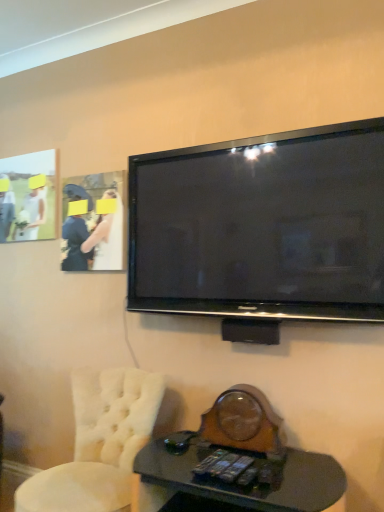
The width and height of the screenshot is (384, 512). Describe the element at coordinates (243, 475) in the screenshot. I see `black glass desk at lower center` at that location.

What do you see at coordinates (262, 227) in the screenshot? I see `black glossy flat-screen tv at upper center` at bounding box center [262, 227].

Where is `white tufted chair at lower left`? The image size is (384, 512). white tufted chair at lower left is located at coordinates [99, 443].

Locate an element on the screen. The image size is (384, 512). black glass desk at lower center is located at coordinates tap(243, 475).

What's the angular difference between black glossy flat-screen tv at upper center and white tufted chair at lower left's facing directions?

1.19 degrees separate the facing orientations of black glossy flat-screen tv at upper center and white tufted chair at lower left.

Image resolution: width=384 pixels, height=512 pixels. I want to click on chair in front of the black glossy flat-screen tv at upper center, so click(99, 443).

Considering the points (230, 306) and (19, 498), which point is in front, point (230, 306) or point (19, 498)?

Positioned in front is point (19, 498).

From a real-world perspective, between black glossy flat-screen tv at upper center and white tufted chair at lower left, who is vertically lower?

white tufted chair at lower left, from a real-world perspective.

Is black glass desk at lower center not inside matte white dress at upper left?

Yes, black glass desk at lower center is located beyond the bounds of matte white dress at upper left.

Is black glass desk at lower center far away from matte white dress at upper left?

Yes, black glass desk at lower center and matte white dress at upper left are located far from each other.

From the image's perspective, is black glass desk at lower center on matte white dress at upper left?

No, from the image's perspective, black glass desk at lower center is not above matte white dress at upper left.

How distant is black glass desk at lower center from white tufted chair at lower left?

14.72 inches.

From the image's perspective, which one is positioned higher, black glass desk at lower center or white tufted chair at lower left?

white tufted chair at lower left, from the image's perspective.

Can white tufted chair at lower left be found inside black glass desk at lower center?

No, white tufted chair at lower left is not a part of black glass desk at lower center.

Considering the relative positions of black glass desk at lower center and white tufted chair at lower left in the image provided, is black glass desk at lower center behind white tufted chair at lower left?

No.

Based on their positions, is matte white picture frame at upper left located to the left or right of black glossy flat-screen tv at upper center?

Based on their positions, matte white picture frame at upper left is located to the left of black glossy flat-screen tv at upper center.

Consider the image. Considering the sizes of objects matte white picture frame at upper left and black glossy flat-screen tv at upper center in the image provided, who is taller, matte white picture frame at upper left or black glossy flat-screen tv at upper center?

black glossy flat-screen tv at upper center is taller.

Considering the positions of point (38, 168) and point (355, 278), is point (38, 168) closer or farther from the camera than point (355, 278)?

Point (38, 168) is positioned farther from the camera compared to point (355, 278).

Which of these two, matte white picture frame at upper left or matte white dress at upper left, is thinner?

With smaller width is matte white picture frame at upper left.

How different are the orientations of matte white picture frame at upper left and matte white dress at upper left in degrees?

The facing directions of matte white picture frame at upper left and matte white dress at upper left are 0.632 degrees apart.

Would you consider matte white picture frame at upper left to be distant from matte white dress at upper left?

matte white picture frame at upper left is near matte white dress at upper left, not far away.

Can you confirm if matte white picture frame at upper left is taller than matte white dress at upper left?

Indeed, matte white picture frame at upper left has a greater height compared to matte white dress at upper left.

From the image's perspective, is black glossy flat-screen tv at upper center over black glass desk at lower center?

Yes, from the image's perspective, black glossy flat-screen tv at upper center is above black glass desk at lower center.

Are black glossy flat-screen tv at upper center and black glass desk at lower center located far from each other?

No, black glossy flat-screen tv at upper center is in close proximity to black glass desk at lower center.

Considering the relative sizes of black glossy flat-screen tv at upper center and black glass desk at lower center in the image provided, is black glossy flat-screen tv at upper center wider than black glass desk at lower center?

No.

In the scene shown: Which object is closer to the camera, black glossy flat-screen tv at upper center or black glass desk at lower center?

black glass desk at lower center.

Which of these two, black glossy flat-screen tv at upper center or matte white picture frame at upper left, stands taller?

black glossy flat-screen tv at upper center is taller.

Is there a large distance between black glossy flat-screen tv at upper center and matte white picture frame at upper left?

Yes, black glossy flat-screen tv at upper center is far from matte white picture frame at upper left.

From the image's perspective, is black glossy flat-screen tv at upper center over matte white picture frame at upper left?

No.

Does point (268, 315) come behind point (35, 159)?

No, (268, 315) is in front of (35, 159).

Locate an element on the screen. television above the white tufted chair at lower left (from the image's perspective) is located at coordinates (262, 227).

Find the location of a particular element. The height and width of the screenshot is (512, 384). desk on the right of the matte white dress at upper left is located at coordinates (243, 475).

Looking at the image, which one is located further to black glossy flat-screen tv at upper center, white tufted chair at lower left or matte white dress at upper left?

white tufted chair at lower left lies further to black glossy flat-screen tv at upper center than the other object.

From the picture: From the image, which object appears to be nearer to white tufted chair at lower left, matte white picture frame at upper left or matte white dress at upper left?

Based on the image, matte white dress at upper left appears to be nearer to white tufted chair at lower left.

From the image, which object appears to be nearer to black glossy flat-screen tv at upper center, matte white dress at upper left or black glass desk at lower center?

matte white dress at upper left is positioned closer to the anchor black glossy flat-screen tv at upper center.

From the image, which object appears to be farther from matte white picture frame at upper left, black glass desk at lower center or black glossy flat-screen tv at upper center?

black glass desk at lower center is further to matte white picture frame at upper left.

Looking at the image, which one is located further to matte white dress at upper left, white tufted chair at lower left or black glossy flat-screen tv at upper center?

white tufted chair at lower left.

Looking at the image, which one is located further to white tufted chair at lower left, black glass desk at lower center or black glossy flat-screen tv at upper center?

black glossy flat-screen tv at upper center is positioned further to the anchor white tufted chair at lower left.

Considering their positions, is black glossy flat-screen tv at upper center positioned further to matte white dress at upper left than white tufted chair at lower left?

white tufted chair at lower left is positioned further to the anchor matte white dress at upper left.

Considering their positions, is black glossy flat-screen tv at upper center positioned further to matte white picture frame at upper left than white tufted chair at lower left?

white tufted chair at lower left.

Locate an element on the screen. This screenshot has width=384, height=512. television between matte white dress at upper left and black glass desk at lower center in the vertical direction is located at coordinates (262, 227).

Where is `person that lies between matte white picture frame at upper left and black glass desk at lower center from top to bottom`? The image size is (384, 512). person that lies between matte white picture frame at upper left and black glass desk at lower center from top to bottom is located at coordinates (107, 237).

At what (x,y) coordinates should I click in order to perform the action: click on television between matte white picture frame at upper left and white tufted chair at lower left from top to bottom. Please return your answer as a coordinate pair (x, y). This screenshot has height=512, width=384. Looking at the image, I should click on (262, 227).

The height and width of the screenshot is (512, 384). In order to click on chair between matte white picture frame at upper left and black glass desk at lower center in the up-down direction in this screenshot , I will do `click(99, 443)`.